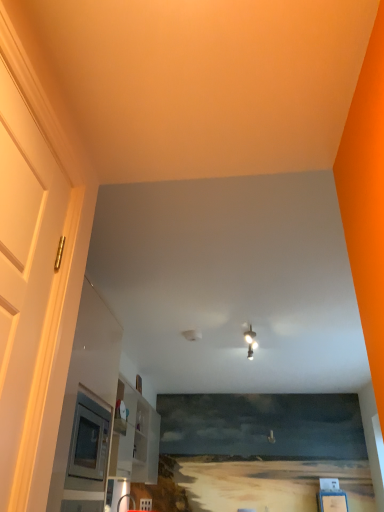
Question: Considering the positions of white glossy light fixture at center and white glossy door at left in the image, is white glossy light fixture at center taller or shorter than white glossy door at left?

Choices:
 (A) short
 (B) tall

Answer: (A)

Question: From the image's perspective, is white glossy light fixture at center located above or below white glossy door at left?

Choices:
 (A) below
 (B) above

Answer: (A)

Question: Based on their sizes in the image, would you say white glossy light fixture at center is bigger or smaller than white glossy door at left?

Choices:
 (A) big
 (B) small

Answer: (B)

Question: Choose the correct answer: Is white glossy door at left inside white glossy light fixture at center or outside it?

Choices:
 (A) outside
 (B) inside

Answer: (A)

Question: Considering the positions of white glossy door at left and white glossy light fixture at center in the image, is white glossy door at left taller or shorter than white glossy light fixture at center?

Choices:
 (A) tall
 (B) short

Answer: (A)

Question: Is white glossy door at left wider or thinner than white glossy light fixture at center?

Choices:
 (A) wide
 (B) thin

Answer: (B)

Question: From a real-world perspective, relative to white glossy light fixture at center, is white glossy door at left vertically above or below?

Choices:
 (A) below
 (B) above

Answer: (A)